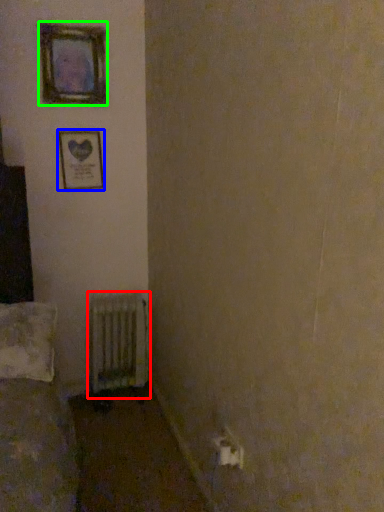
Question: Which is farther away from radiator (highlighted by a red box)? picture frame (highlighted by a blue box) or picture frame (highlighted by a green box)?

Choices:
 (A) picture frame
 (B) picture frame

Answer: (B)